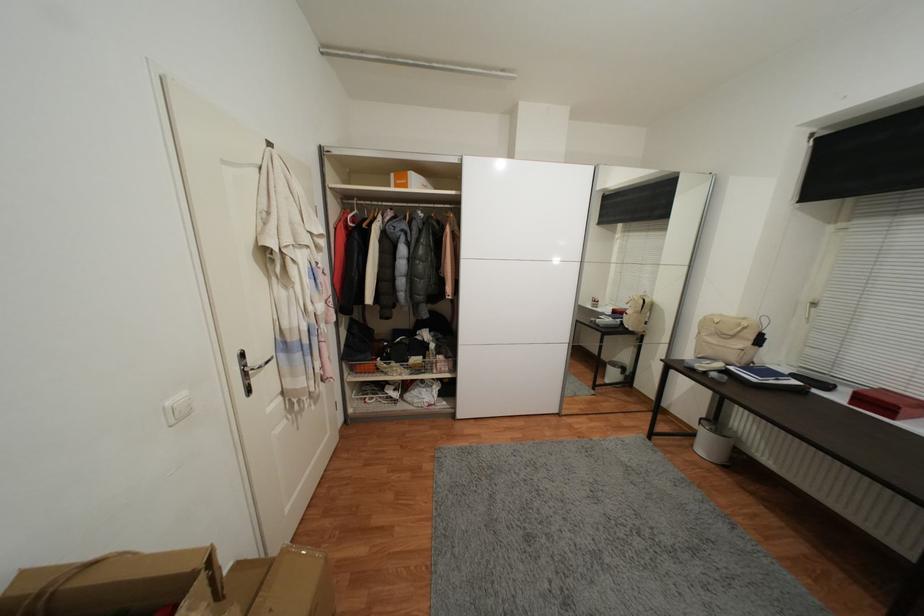
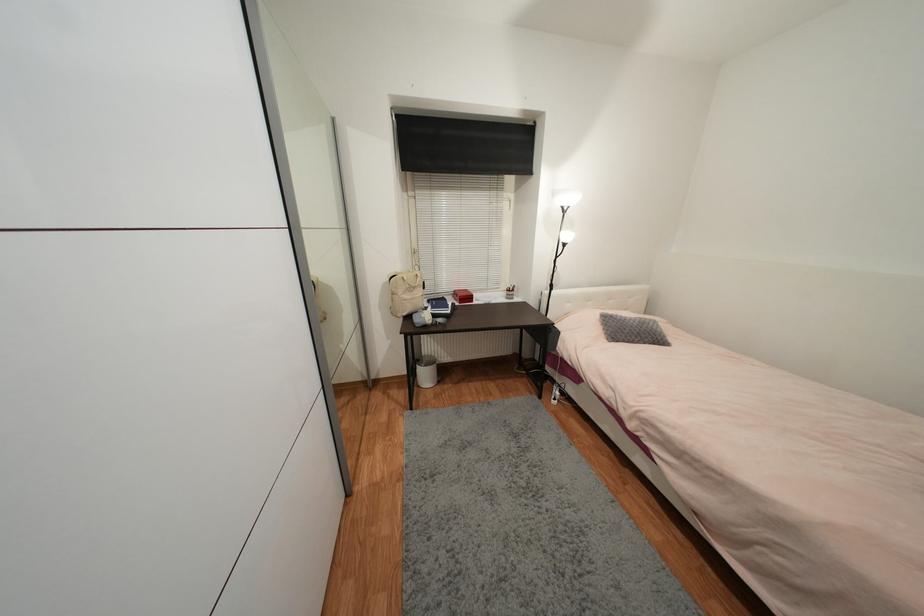
The point at (x=748, y=321) is marked in the first image. Where is the corresponding point in the second image?

(412, 273)